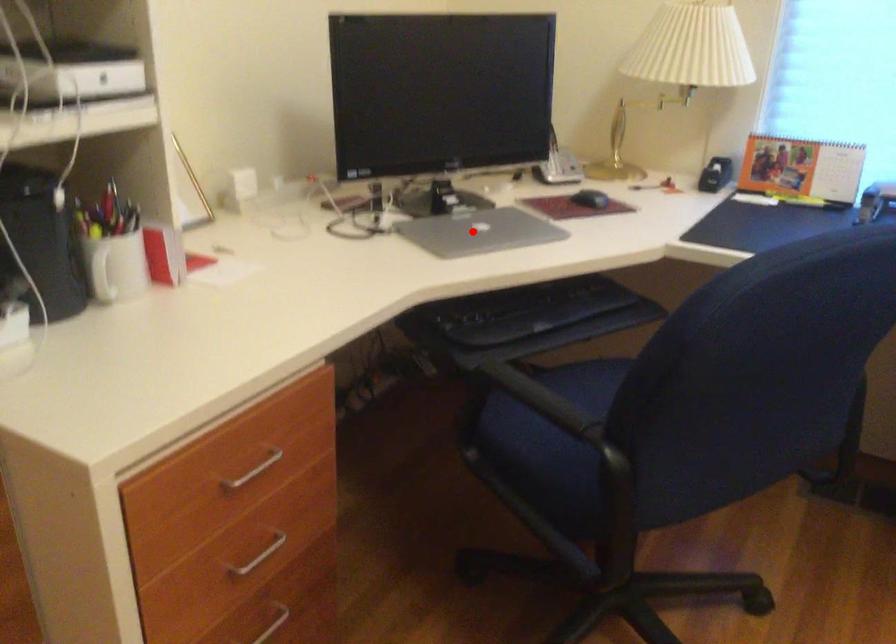
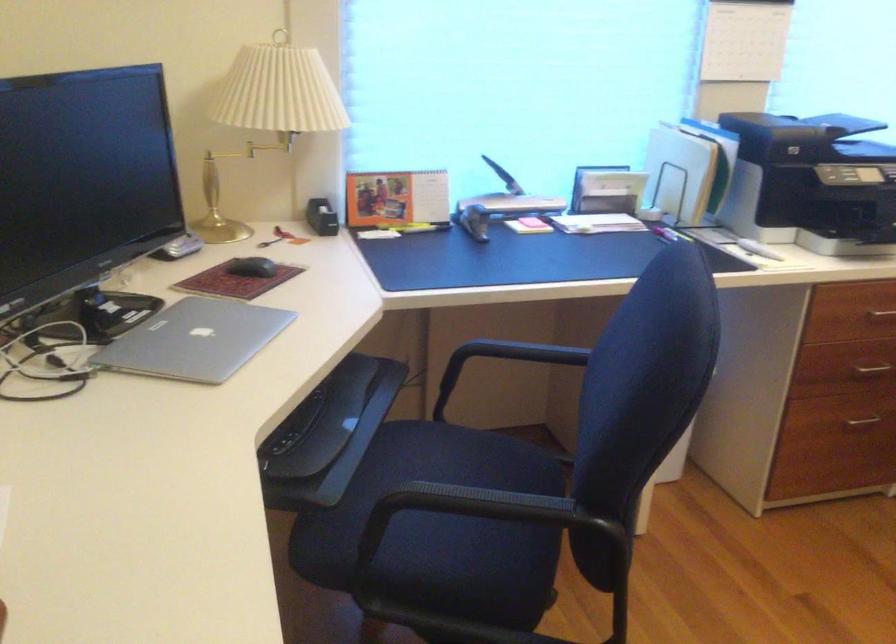
Question: I am providing you with two images of the same scene from different viewpoints. A red point is shown in image1. For the corresponding object point in image2, is it positioned nearer or farther from the camera?

Choices:
 (A) Nearer
 (B) Farther

Answer: (A)